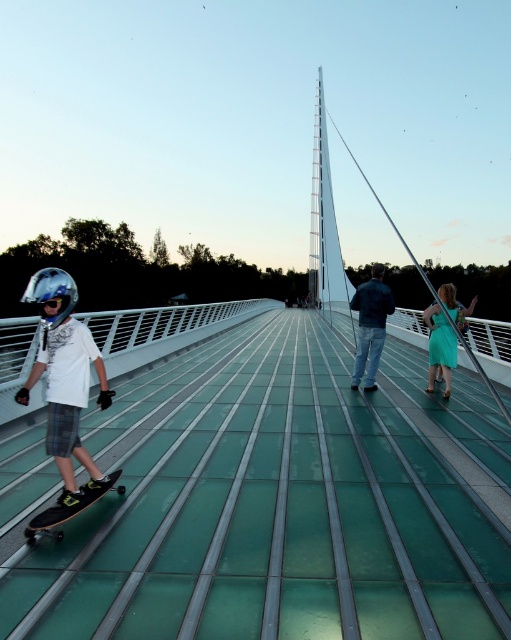
Question: Where is transparent glass bridge at center located in relation to shiny silver helmet at left in the image?

Choices:
 (A) above
 (B) below

Answer: (B)

Question: Does transparent glass bridge at center appear on the right side of shiny silver helmet at left?

Choices:
 (A) no
 (B) yes

Answer: (B)

Question: Among these objects, which one is farthest from the camera?

Choices:
 (A) transparent glass bridge at center
 (B) shiny silver helmet at left
 (C) blue jeans at center
 (D) teal satin dress at right

Answer: (C)

Question: Is transparent glass bridge at center wider than silver metallic helmet at left?

Choices:
 (A) no
 (B) yes

Answer: (A)

Question: Estimate the real-world distances between objects in this image. Which object is farther from the transparent glass bridge at center?

Choices:
 (A) black matte skateboard at lower left
 (B) blue jeans at center
 (C) teal satin dress at right

Answer: (B)

Question: Which is farther from the transparent glass bridge at center?

Choices:
 (A) teal satin dress at right
 (B) shiny silver helmet at left
 (C) black matte skateboard at lower left
 (D) silver metallic helmet at left

Answer: (D)